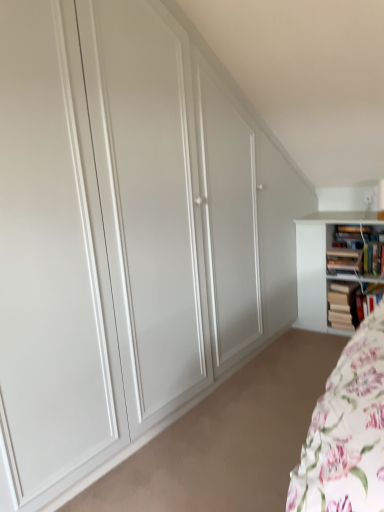
Question: Could you tell me if wooden book at right, which appears as the 3th book when viewed from the top, is turned towards hardcover book at right, which is counted as the first book, starting from the bottom?

Choices:
 (A) no
 (B) yes

Answer: (A)

Question: Can you confirm if wooden book at right, marked as the 2th book in a bottom-to-top arrangement, is wider than hardcover book at right, which is counted as the first book, starting from the bottom?

Choices:
 (A) no
 (B) yes

Answer: (B)

Question: Is wooden book at right, which appears as the 3th book when viewed from the top, not near hardcover book at right, placed as the fourth book when sorted from top to bottom?

Choices:
 (A) yes
 (B) no

Answer: (B)

Question: Is wooden book at right, marked as the 2th book in a bottom-to-top arrangement, positioned behind hardcover book at right, placed as the fourth book when sorted from top to bottom?

Choices:
 (A) no
 (B) yes

Answer: (B)

Question: Considering the relative positions of wooden book at right, which appears as the 3th book when viewed from the top, and hardcover book at right, placed as the fourth book when sorted from top to bottom, in the image provided, is wooden book at right, which appears as the 3th book when viewed from the top, to the left of hardcover book at right, placed as the fourth book when sorted from top to bottom, from the viewer's perspective?

Choices:
 (A) yes
 (B) no

Answer: (A)

Question: Is hardcover books at upper right, the fourth book when ordered from bottom to top, to the left or to the right of wooden bookshelf at right, the 3th book positioned from the bottom, in the image?

Choices:
 (A) right
 (B) left

Answer: (A)

Question: Looking at the image, does hardcover books at upper right, the fourth book when ordered from bottom to top, seem bigger or smaller compared to wooden bookshelf at right, the 3th book positioned from the bottom?

Choices:
 (A) small
 (B) big

Answer: (B)

Question: Considering the positions of hardcover books at upper right, which ranks as the first book in top-to-bottom order, and wooden bookshelf at right, the second book when ordered from top to bottom, in the image, is hardcover books at upper right, which ranks as the first book in top-to-bottom order, wider or thinner than wooden bookshelf at right, the second book when ordered from top to bottom,?

Choices:
 (A) thin
 (B) wide

Answer: (B)

Question: Is hardcover books at upper right, the fourth book when ordered from bottom to top, spatially inside wooden bookshelf at right, the second book when ordered from top to bottom, or outside of it?

Choices:
 (A) inside
 (B) outside

Answer: (B)

Question: From a real-world perspective, relative to hardcover book at right, which is counted as the first book, starting from the bottom, is wooden bookshelf at right, the 3th book positioned from the bottom, vertically above or below?

Choices:
 (A) below
 (B) above

Answer: (B)

Question: From the image's perspective, is wooden bookshelf at right, the second book when ordered from top to bottom, positioned above or below hardcover book at right, placed as the fourth book when sorted from top to bottom?

Choices:
 (A) above
 (B) below

Answer: (A)

Question: Looking at their shapes, would you say wooden bookshelf at right, the second book when ordered from top to bottom, is wider or thinner than hardcover book at right, which is counted as the first book, starting from the bottom?

Choices:
 (A) thin
 (B) wide

Answer: (A)

Question: Based on their positions, is wooden bookshelf at right, the 3th book positioned from the bottom, located to the left or right of hardcover book at right, which is counted as the first book, starting from the bottom?

Choices:
 (A) right
 (B) left

Answer: (B)

Question: In terms of size, does wooden book at right, which appears as the 3th book when viewed from the top, appear bigger or smaller than wooden bookshelf at right, the 3th book positioned from the bottom?

Choices:
 (A) small
 (B) big

Answer: (B)

Question: Considering the positions of wooden book at right, marked as the 2th book in a bottom-to-top arrangement, and wooden bookshelf at right, the second book when ordered from top to bottom, in the image, is wooden book at right, marked as the 2th book in a bottom-to-top arrangement, wider or thinner than wooden bookshelf at right, the second book when ordered from top to bottom,?

Choices:
 (A) wide
 (B) thin

Answer: (A)